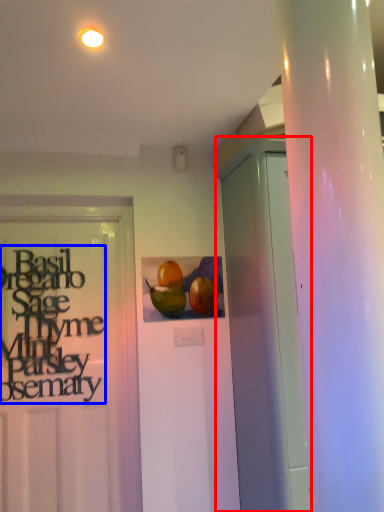
Question: Which object is closer to the camera taking this photo, garage door (highlighted by a red box) or lettering (highlighted by a blue box)?

Choices:
 (A) garage door
 (B) lettering

Answer: (A)